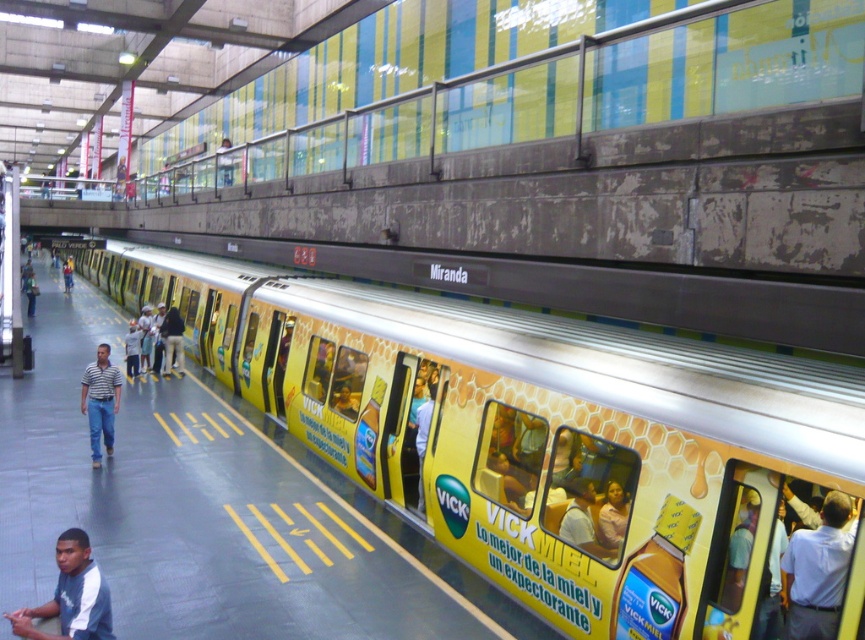
You are standing on the Miranda subway platform and want to board the yellow glossy train at center. The platform has yellow tactile paving. Where should you position yourself relative to the tactile paving to reach the train doors?

The yellow glossy train at center is located at point [535,435], so you should position yourself near the tactile paving closest to that coordinate to reach the train doors.

You are standing on the Miranda subway platform and see a blue jersey at lower left and a striped cotton shirt at center. Which clothing item is positioned more to the right?

The blue jersey at lower left is positioned to the right of the striped cotton shirt at center, so the blue jersey at lower left is more to the right.